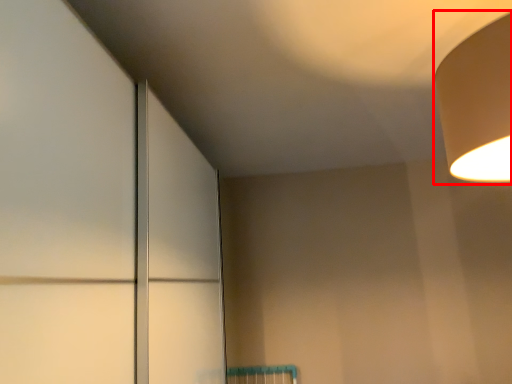
Question: From the image's perspective, considering the relative positions of lamp (annotated by the red box) and door in the image provided, where is lamp (annotated by the red box) located with respect to the staircase?

Choices:
 (A) above
 (B) below

Answer: (A)